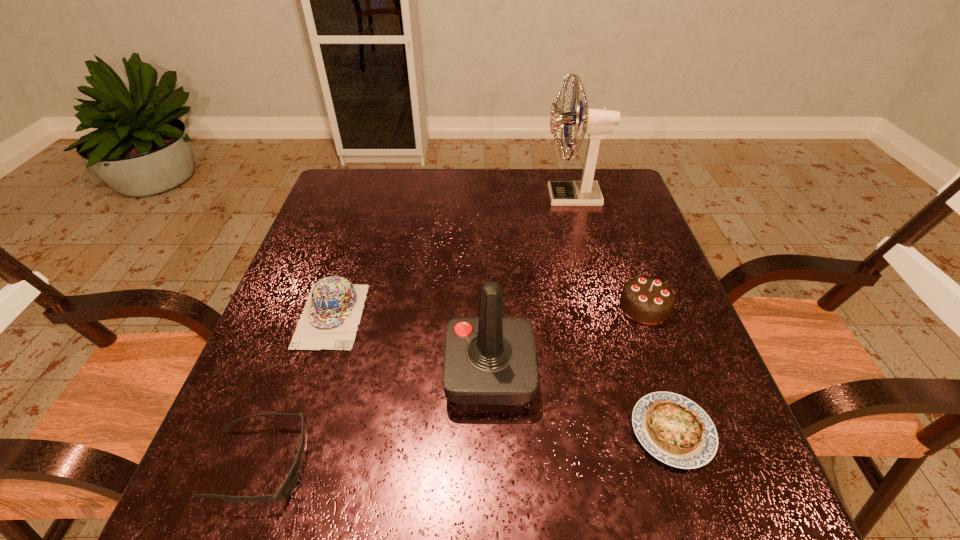
The image size is (960, 540). I want to click on vacant area situated 0.070m on the front-facing side of the farthest object, so click(x=520, y=196).

Identify the location of free space located on the right of the second tallest object. (676, 373).

Where is `vacant space located on the left of the chocolate cake`? vacant space located on the left of the chocolate cake is located at coordinates (468, 307).

Locate an element on the screen. vacant space located 0.290m on the front, side, and top of the cap is located at coordinates (273, 501).

I want to click on vacant space located on the front-facing side of the fifth tallest object, so click(511, 463).

Where is `free space located 0.130m on the left of the shortest object`? The image size is (960, 540). free space located 0.130m on the left of the shortest object is located at coordinates (558, 431).

You are a GUI agent. You are given a task and a screenshot of the screen. Output one action in this format:
    pyautogui.click(x=<x>, y=<y>)
    Task: Click on the object present at the far edge
    
    Given the screenshot: What is the action you would take?
    pyautogui.click(x=597, y=123)

Where is `sunglasses that is positioned at the near edge`? Image resolution: width=960 pixels, height=540 pixels. sunglasses that is positioned at the near edge is located at coordinates (287, 487).

The height and width of the screenshot is (540, 960). I want to click on quiche situated at the near edge, so click(675, 430).

Find the location of a particular element. cap that is at the left edge is located at coordinates (330, 319).